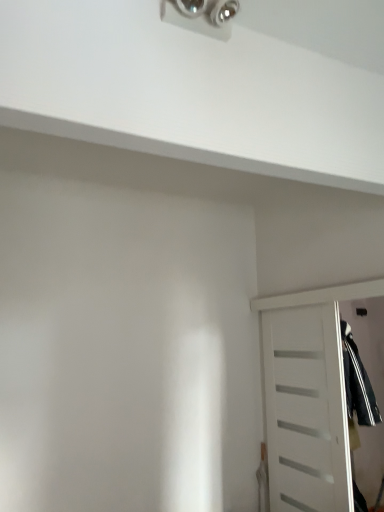
In order to click on metallic silver light fixture at upper center in this screenshot , I will do `click(201, 16)`.

What do you see at coordinates (201, 16) in the screenshot? I see `metallic silver light fixture at upper center` at bounding box center [201, 16].

This screenshot has height=512, width=384. What are the coordinates of `metallic silver light fixture at upper center` in the screenshot? It's located at (201, 16).